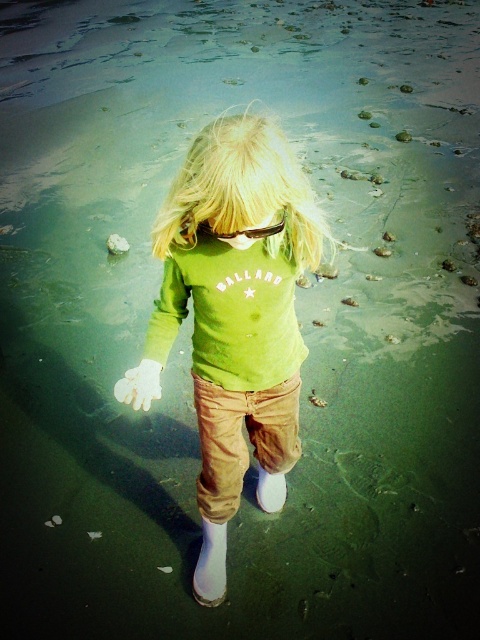
Question: Considering the relative positions of blonde hair at center and black plastic goggles at center in the image provided, where is blonde hair at center located with respect to black plastic goggles at center?

Choices:
 (A) above
 (B) below

Answer: (A)

Question: Which object appears closest to the camera in this image?

Choices:
 (A) blonde hair at center
 (B) black plastic goggles at center
 (C) green matte shirt at center
 (D) khaki corduroy pants at center

Answer: (A)

Question: Which of these objects is positioned farthest from the khaki corduroy pants at center?

Choices:
 (A) blonde hair at center
 (B) black plastic goggles at center
 (C) green matte shirt at center

Answer: (B)

Question: Which of the following is the closest to the observer?

Choices:
 (A) (228, 396)
 (B) (215, 236)
 (C) (275, 192)
 (D) (275, 412)

Answer: (C)

Question: Is green matte shirt at center to the left of khaki corduroy pants at center from the viewer's perspective?

Choices:
 (A) yes
 (B) no

Answer: (A)

Question: Is khaki corduroy pants at center thinner than black plastic goggles at center?

Choices:
 (A) no
 (B) yes

Answer: (A)